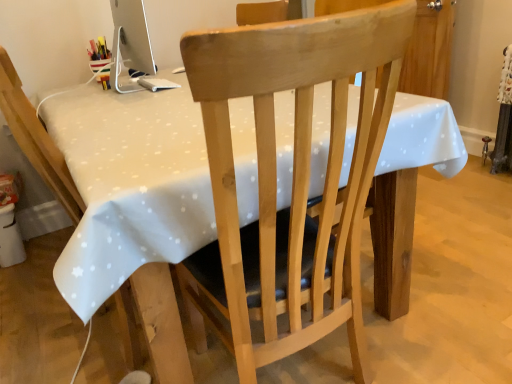
Image resolution: width=512 pixels, height=384 pixels. What are the coordinates of `vacant region to the right of natural wood chair at center, the first chair from the right` in the screenshot? It's located at (429, 336).